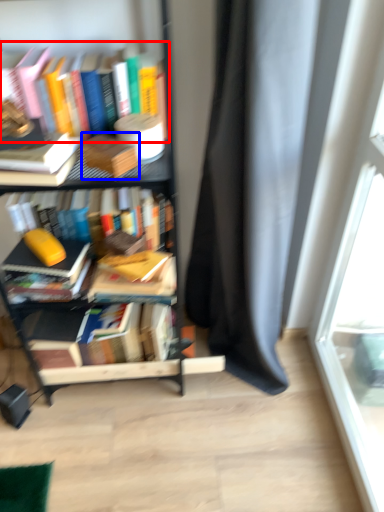
Question: Which of the following is the farthest to the observer, book (highlighted by a red box) or paperback book (highlighted by a blue box)?

Choices:
 (A) book
 (B) paperback book

Answer: (A)